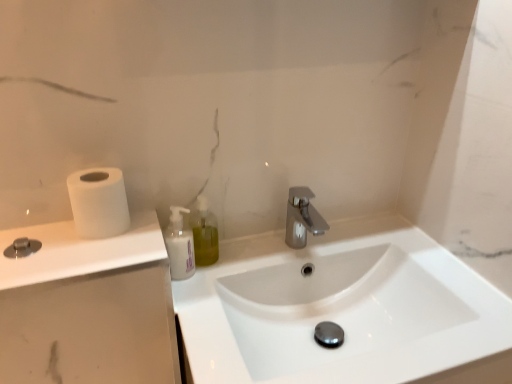
Locate an element on the screen. The image size is (512, 384). vacant area on the back side of polished chrome faucet at center is located at coordinates (310, 231).